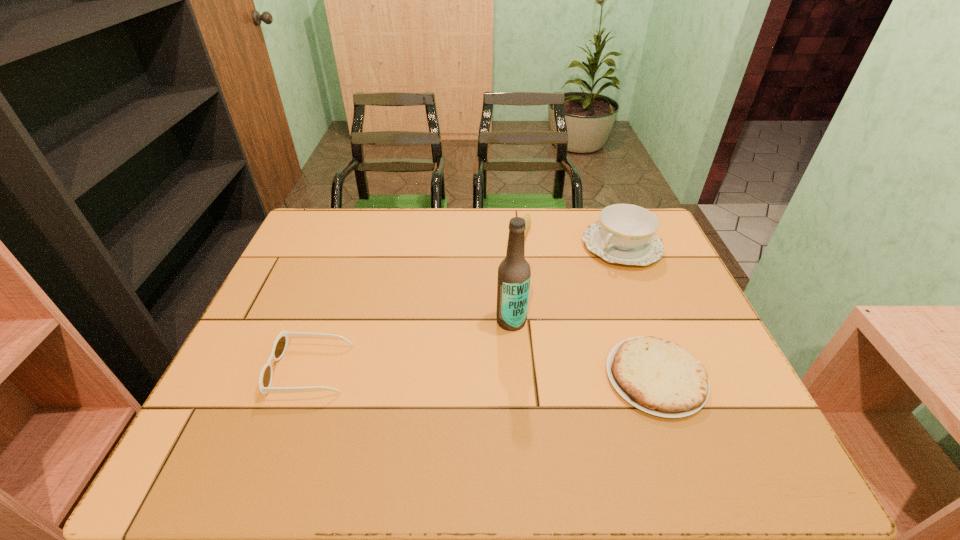
Image resolution: width=960 pixels, height=540 pixels. What are the coordinates of `free region located 0.080m at the stem of the banana` in the screenshot? It's located at (513, 267).

Locate an element on the screen. vacant area located 0.200m at the stem of the banana is located at coordinates (501, 294).

Image resolution: width=960 pixels, height=540 pixels. Find the location of `vacant space situated 0.260m on the side of the beer bottle with the label`. vacant space situated 0.260m on the side of the beer bottle with the label is located at coordinates (425, 395).

In order to click on vacant space located 0.060m on the side of the beer bottle with the label in this screenshot , I will do (x=486, y=343).

Locate an element on the screen. vacant space located on the side of the beer bottle with the label is located at coordinates (418, 401).

Find the location of a particular element. The height and width of the screenshot is (540, 960). vacant space located on the handle side of the chinaware is located at coordinates (537, 313).

Where is `vacant space positioned on the handle side of the chinaware`? Image resolution: width=960 pixels, height=540 pixels. vacant space positioned on the handle side of the chinaware is located at coordinates (509, 336).

The image size is (960, 540). I want to click on vacant region located 0.220m on the handle side of the chinaware, so click(554, 300).

This screenshot has height=540, width=960. I want to click on banana at the far edge, so click(527, 218).

Locate an element on the screen. The width and height of the screenshot is (960, 540). chinaware located in the far edge section of the desktop is located at coordinates (626, 234).